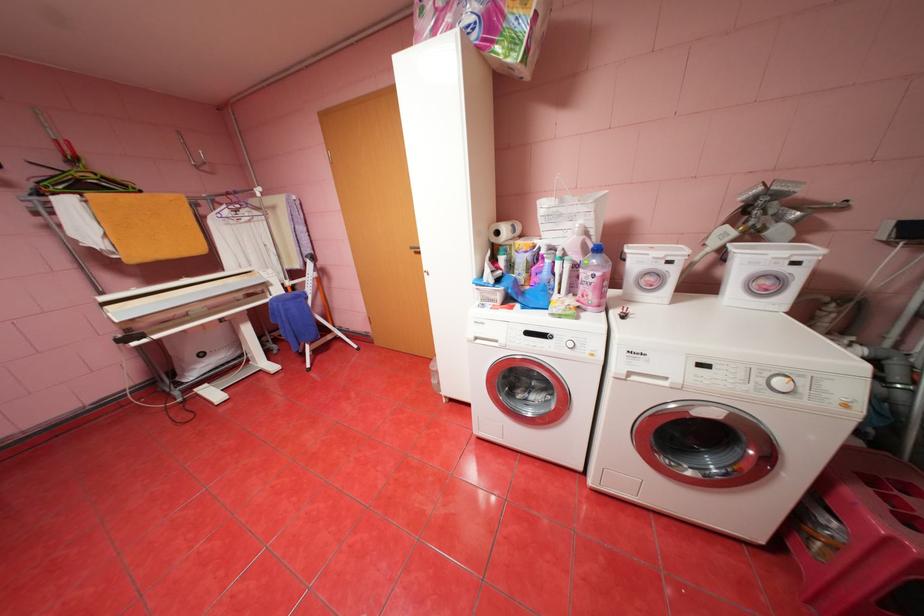
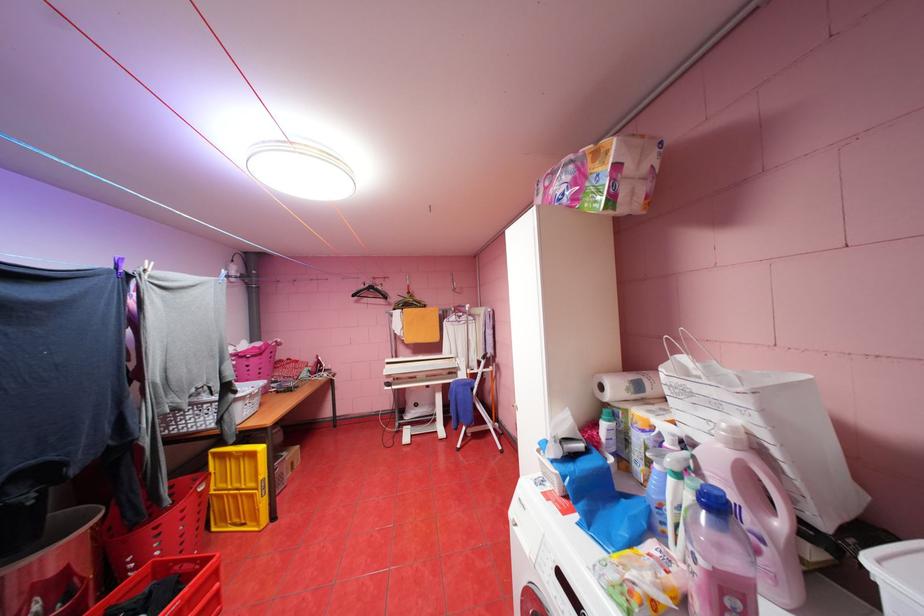
Where in the second image is the point corresponding to pixel 505 233 from the first image?

(610, 387)